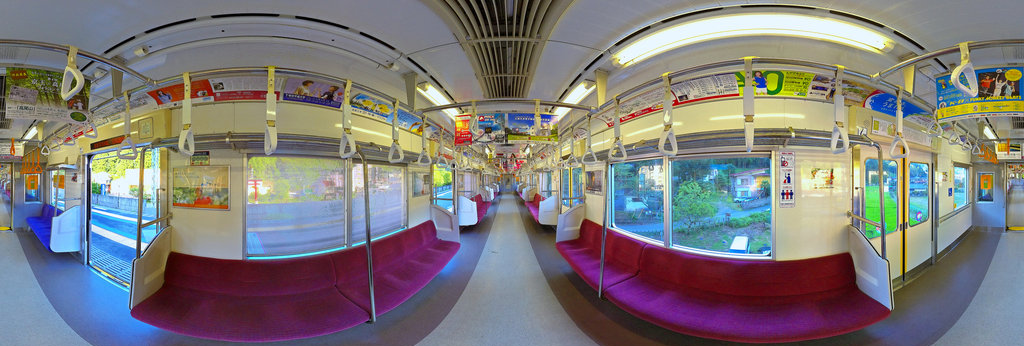
Find the location of a particular element. The image size is (1024, 346). handle is located at coordinates (81, 82).